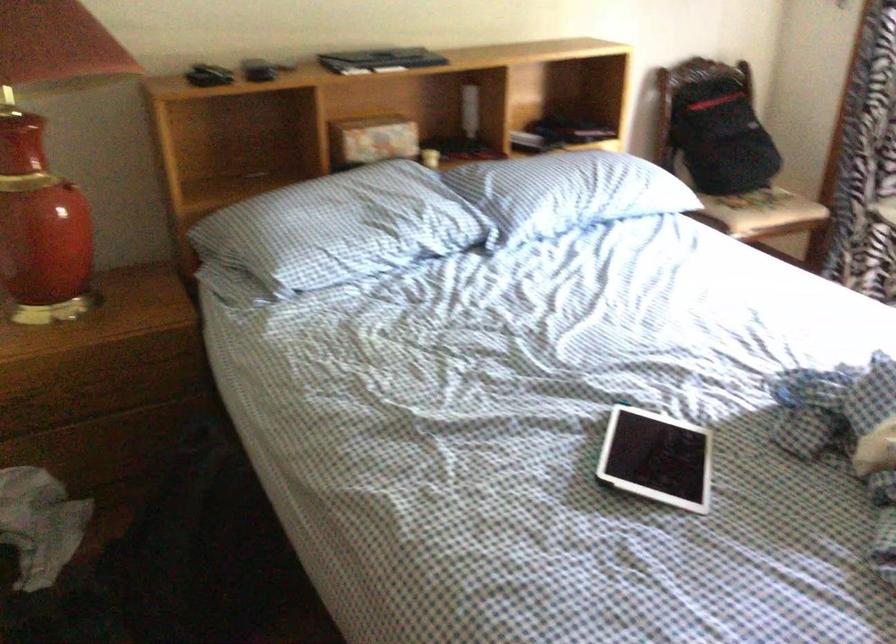
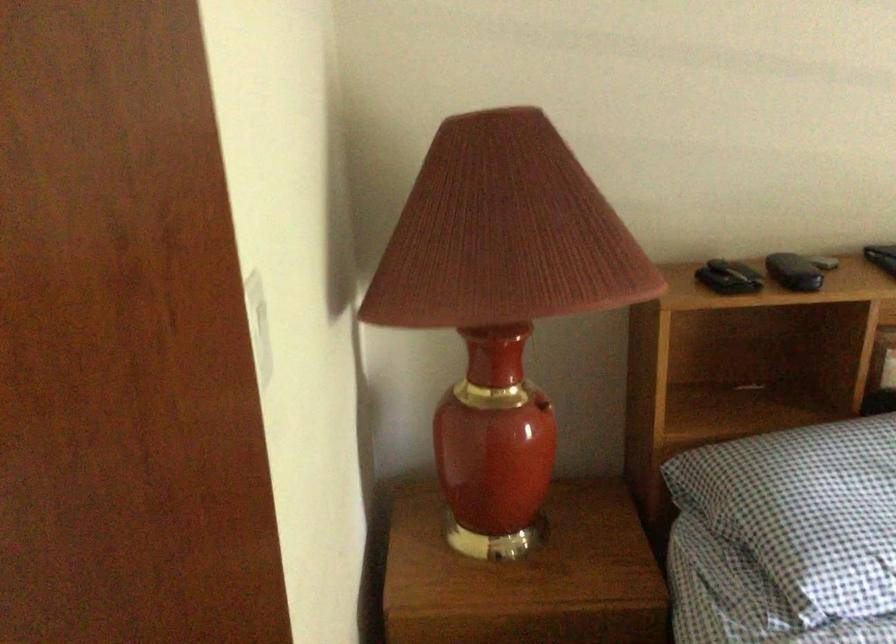
Question: Based on the continuous images, in which direction is the camera rotating? Reply with the corresponding letter.

Choices:
 (A) Left
 (B) Right
 (C) Up
 (D) Down

Answer: (A)